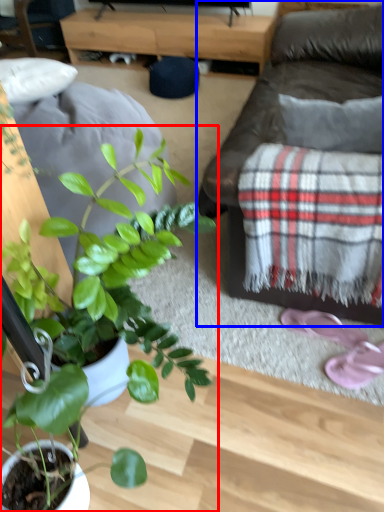
Question: Which object is closer to the camera taking this photo, houseplant (highlighted by a red box) or studio couch (highlighted by a blue box)?

Choices:
 (A) houseplant
 (B) studio couch

Answer: (A)